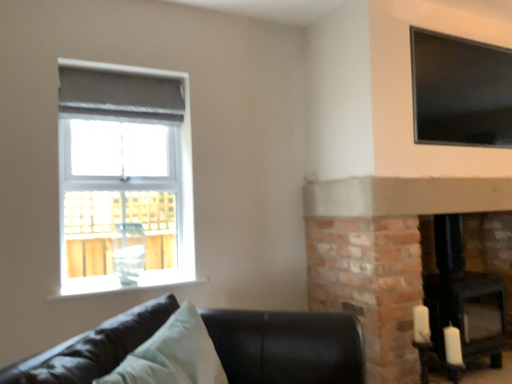
I want to click on matte gray roller blind at upper left, which is the 2th window in right-to-left order, so click(x=124, y=178).

Describe the element at coordinates (172, 355) in the screenshot. This screenshot has height=384, width=512. I see `light blue fabric pillow at lower left` at that location.

Locate an element on the screen. The width and height of the screenshot is (512, 384). transparent glass window at upper right, the first window in the right-to-left sequence is located at coordinates (460, 91).

Considering the points (62, 174) and (278, 312), which point is in front, point (62, 174) or point (278, 312)?

Positioned in front is point (278, 312).

Based on the photo, which of these two, matte gray roller blind at upper left, which is the 2th window in right-to-left order, or black leather couch at lower left, is wider?

With larger width is black leather couch at lower left.

Does matte gray roller blind at upper left, the first window positioned from the left, lie in front of black leather couch at lower left?

No, matte gray roller blind at upper left, the first window positioned from the left, is further to the viewer.

Is matte gray roller blind at upper left, which is the 2th window in right-to-left order, facing away from light blue fabric pillow at lower left?

No, matte gray roller blind at upper left, which is the 2th window in right-to-left order, is not facing the opposite direction of light blue fabric pillow at lower left.

From the image's perspective, is matte gray roller blind at upper left, which is the 2th window in right-to-left order, above light blue fabric pillow at lower left?

Yes, from the image's perspective, matte gray roller blind at upper left, which is the 2th window in right-to-left order, is over light blue fabric pillow at lower left.

From a real-world perspective, which is physically above, matte gray roller blind at upper left, which is the 2th window in right-to-left order, or light blue fabric pillow at lower left?

In real-world perspective, matte gray roller blind at upper left, which is the 2th window in right-to-left order, is above.

Considering the relative sizes of matte gray roller blind at upper left, which is the 2th window in right-to-left order, and light blue fabric pillow at lower left in the image provided, is matte gray roller blind at upper left, which is the 2th window in right-to-left order, bigger than light blue fabric pillow at lower left?

Yes, matte gray roller blind at upper left, which is the 2th window in right-to-left order, is bigger than light blue fabric pillow at lower left.

Is black leather couch at lower left thinner than black matte fireplace at lower right?

In fact, black leather couch at lower left might be wider than black matte fireplace at lower right.

The height and width of the screenshot is (384, 512). I want to click on studio couch above the black matte fireplace at lower right (from a real-world perspective), so click(x=287, y=346).

From the image's perspective, who appears lower, black leather couch at lower left or black matte fireplace at lower right?

black matte fireplace at lower right is shown below in the image.

Does light blue fabric pillow at lower left touch black leather couch at lower left?

light blue fabric pillow at lower left and black leather couch at lower left are clearly separated.

Looking at this image, who is bigger, light blue fabric pillow at lower left or black leather couch at lower left?

black leather couch at lower left.

Does light blue fabric pillow at lower left have a lesser width compared to black leather couch at lower left?

Yes, light blue fabric pillow at lower left is thinner than black leather couch at lower left.

Is black leather couch at lower left at the left side of matte gray roller blind at upper left, which is the 2th window in right-to-left order?

No.

How far apart are black leather couch at lower left and matte gray roller blind at upper left, the first window positioned from the left?

They are 1.33 meters apart.

Considering the relative sizes of black leather couch at lower left and matte gray roller blind at upper left, which is the 2th window in right-to-left order, in the image provided, is black leather couch at lower left bigger than matte gray roller blind at upper left, which is the 2th window in right-to-left order,?

Yes.

Between black matte fireplace at lower right and light blue fabric pillow at lower left, which one has more height?

Standing taller between the two is black matte fireplace at lower right.

Is black matte fireplace at lower right inside or outside of light blue fabric pillow at lower left?

black matte fireplace at lower right is located beyond the bounds of light blue fabric pillow at lower left.

From the image's perspective, is black matte fireplace at lower right above or below light blue fabric pillow at lower left?

black matte fireplace at lower right is below light blue fabric pillow at lower left.

Looking at the image, does light blue fabric pillow at lower left seem bigger or smaller compared to black matte fireplace at lower right?

light blue fabric pillow at lower left is smaller than black matte fireplace at lower right.

Are light blue fabric pillow at lower left and black matte fireplace at lower right far apart?

That's right, there is a large distance between light blue fabric pillow at lower left and black matte fireplace at lower right.

Identify the location of fireplace below the light blue fabric pillow at lower left (from the image's perspective). This screenshot has height=384, width=512. (460, 295).

From the black leather couch at lower left, count 1st windows backward and point to it. Please provide its 2D coordinates.

[(124, 178)]

At what (x,y) coordinates should I click in order to perform the action: click on the 1st window above the light blue fabric pillow at lower left (from a real-world perspective). Please return your answer as a coordinate pair (x, y). The width and height of the screenshot is (512, 384). Looking at the image, I should click on (124, 178).

From the image, which object appears to be nearer to black matte fireplace at lower right, matte gray roller blind at upper left, which is the 2th window in right-to-left order, or black leather couch at lower left?

black leather couch at lower left.

Looking at the image, which one is located closer to matte gray roller blind at upper left, the first window positioned from the left, light blue fabric pillow at lower left or black leather couch at lower left?

black leather couch at lower left.

Looking at the image, which one is located further to black leather couch at lower left, matte gray roller blind at upper left, which is the 2th window in right-to-left order, or black matte fireplace at lower right?

black matte fireplace at lower right lies further to black leather couch at lower left than the other object.

Estimate the real-world distances between objects in this image. Which object is closer to matte gray roller blind at upper left, the first window positioned from the left, transparent glass window at upper right, the first window in the right-to-left sequence, or black leather couch at lower left?

black leather couch at lower left.

From the picture: Which object lies nearer to the anchor point black matte fireplace at lower right, transparent glass window at upper right, marked as the second window in a left-to-right arrangement, or matte gray roller blind at upper left, the first window positioned from the left?

transparent glass window at upper right, marked as the second window in a left-to-right arrangement.

When comparing their distances from light blue fabric pillow at lower left, does black leather couch at lower left or transparent glass window at upper right, marked as the second window in a left-to-right arrangement, seem further?

transparent glass window at upper right, marked as the second window in a left-to-right arrangement, is positioned further to the anchor light blue fabric pillow at lower left.

Based on their spatial positions, is light blue fabric pillow at lower left or black leather couch at lower left closer to black matte fireplace at lower right?

black leather couch at lower left.

From the image, which object appears to be farther from matte gray roller blind at upper left, the first window positioned from the left, light blue fabric pillow at lower left or transparent glass window at upper right, marked as the second window in a left-to-right arrangement?

transparent glass window at upper right, marked as the second window in a left-to-right arrangement, is positioned further to the anchor matte gray roller blind at upper left, the first window positioned from the left.

At what (x,y) coordinates should I click in order to perform the action: click on pillow situated between matte gray roller blind at upper left, which is the 2th window in right-to-left order, and transparent glass window at upper right, the first window in the right-to-left sequence, from left to right. Please return your answer as a coordinate pair (x, y). Image resolution: width=512 pixels, height=384 pixels. Looking at the image, I should click on (172, 355).

You are a GUI agent. You are given a task and a screenshot of the screen. Output one action in this format:
    pyautogui.click(x=<x>, y=<y>)
    Task: Click on the pillow located between matte gray roller blind at upper left, which is the 2th window in right-to-left order, and black matte fireplace at lower right in the left-right direction
    Image resolution: width=512 pixels, height=384 pixels.
    Given the screenshot: What is the action you would take?
    pyautogui.click(x=172, y=355)

Locate an element on the screen. pillow between black leather couch at lower left and matte gray roller blind at upper left, the first window positioned from the left, from front to back is located at coordinates (172, 355).

Where is `fireplace between matte gray roller blind at upper left, the first window positioned from the left, and transparent glass window at upper right, the first window in the right-to-left sequence, in the horizontal direction`? fireplace between matte gray roller blind at upper left, the first window positioned from the left, and transparent glass window at upper right, the first window in the right-to-left sequence, in the horizontal direction is located at coordinates (460, 295).